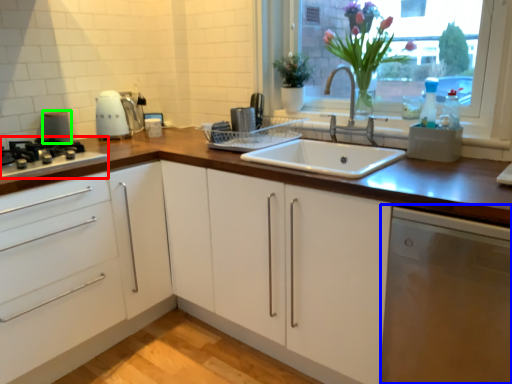
Question: Considering the real-world distances, which object is closest to home appliance (highlighted by a red box)? dish washer (highlighted by a blue box) or appliance (highlighted by a green box).

Choices:
 (A) dish washer
 (B) appliance

Answer: (B)